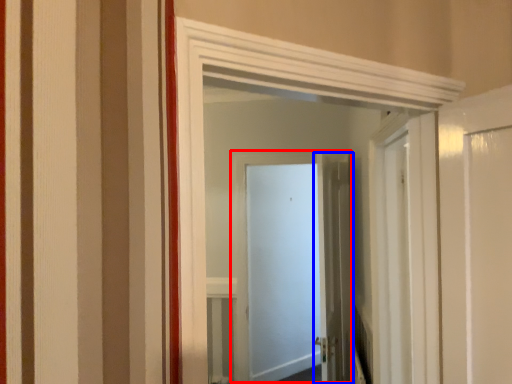
Question: Among these objects, which one is nearest to the camera, door (highlighted by a red box) or door (highlighted by a blue box)?

Choices:
 (A) door
 (B) door

Answer: (B)